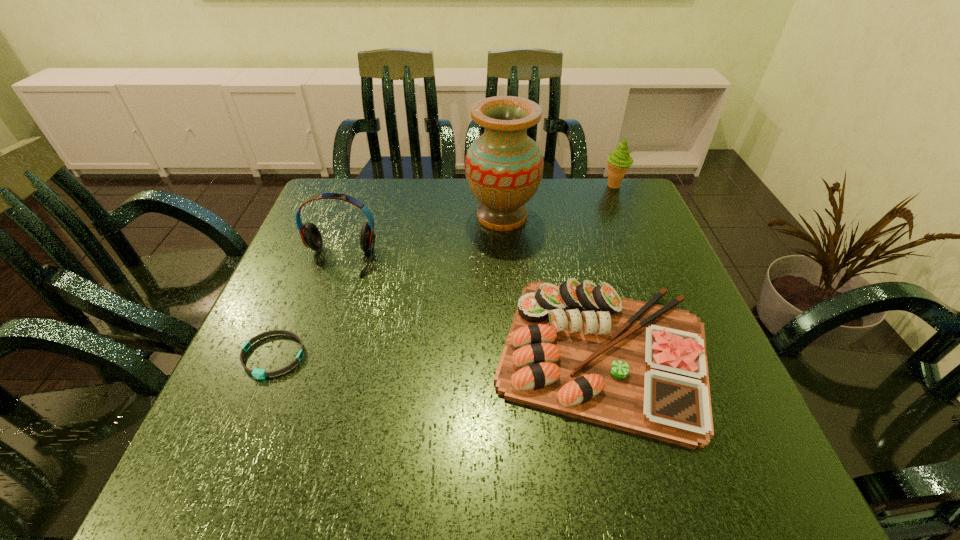
Identify the location of vacant area situated on the buckle of the shortest object. (250, 410).

Find the location of a particular element. The height and width of the screenshot is (540, 960). vase present at the far edge is located at coordinates (503, 167).

The height and width of the screenshot is (540, 960). Identify the location of icecream situated at the far edge. (618, 161).

The width and height of the screenshot is (960, 540). What are the coordinates of `object located at the near edge` in the screenshot? It's located at (577, 349).

You are a GUI agent. You are given a task and a screenshot of the screen. Output one action in this format:
    pyautogui.click(x=<x>, y=<y>)
    Task: Click on the headset located at the left edge
    The image size is (960, 540).
    Given the screenshot: What is the action you would take?
    pyautogui.click(x=311, y=237)

Where is `wristband at the left edge`? Image resolution: width=960 pixels, height=540 pixels. wristband at the left edge is located at coordinates [x=256, y=373].

The image size is (960, 540). I want to click on icecream located in the right edge section of the desktop, so click(618, 161).

Where is `platter that is at the right edge`? The image size is (960, 540). platter that is at the right edge is located at coordinates (577, 349).

Locate an element on the screen. The width and height of the screenshot is (960, 540). object present at the far right corner is located at coordinates (618, 161).

You are a GUI agent. You are given a task and a screenshot of the screen. Output one action in this format:
    pyautogui.click(x=<x>, y=<y>)
    Task: Click on the object present at the near right corner
    The width and height of the screenshot is (960, 540).
    Given the screenshot: What is the action you would take?
    pyautogui.click(x=577, y=349)